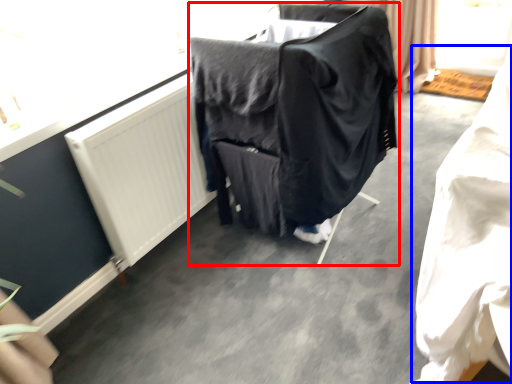
Question: Which point is further to the camera, furniture (highlighted by a red box) or clothing (highlighted by a blue box)?

Choices:
 (A) furniture
 (B) clothing

Answer: (A)